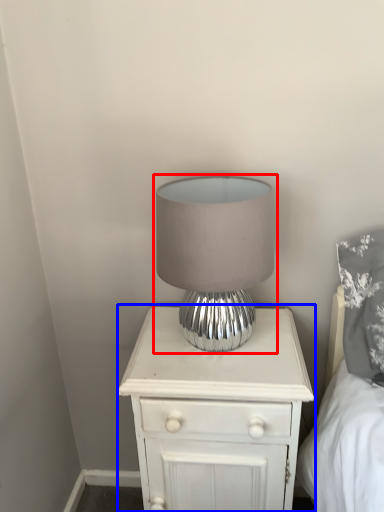
Question: Among these objects, which one is farthest to the camera, lamp (highlighted by a red box) or nightstand (highlighted by a blue box)?

Choices:
 (A) lamp
 (B) nightstand

Answer: (B)